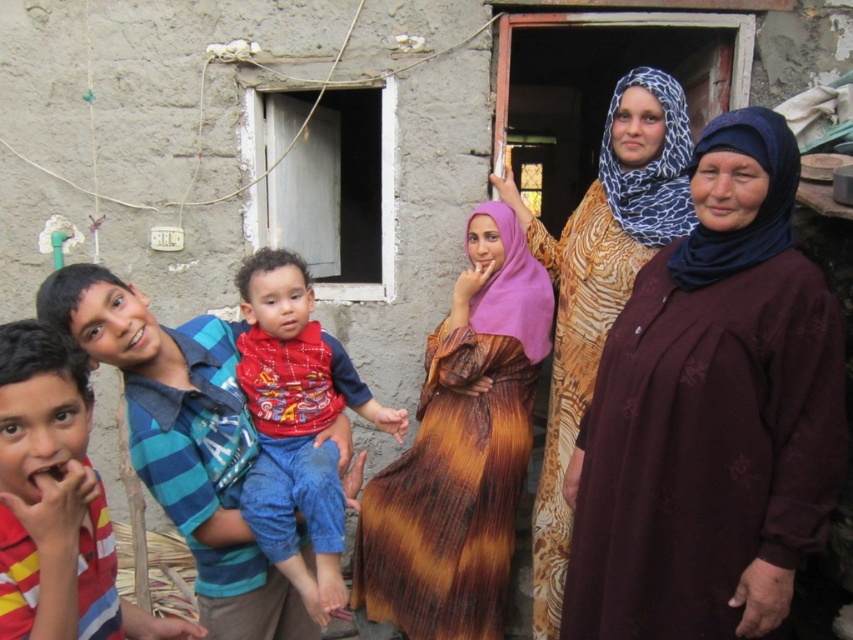
Question: Is brown textured dress at center wider than striped cotton shirt at lower left?

Choices:
 (A) no
 (B) yes

Answer: (B)

Question: Which point is closer to the camera?

Choices:
 (A) (756, 129)
 (B) (445, 403)

Answer: (A)

Question: Does maroon fabric dress at center appear on the right side of red cotton shirt at center?

Choices:
 (A) no
 (B) yes

Answer: (B)

Question: Can you confirm if maroon fabric dress at center is positioned above printed silk dress at center?

Choices:
 (A) no
 (B) yes

Answer: (A)

Question: Which point is farther to the camera?

Choices:
 (A) (524, 456)
 (B) (665, 243)
 (C) (598, 536)
 (D) (9, 586)

Answer: (A)

Question: Which object is positioned farthest from the printed silk dress at center?

Choices:
 (A) striped cotton shirt at lower left
 (B) red cotton shirt at center
 (C) brown textured dress at center

Answer: (A)